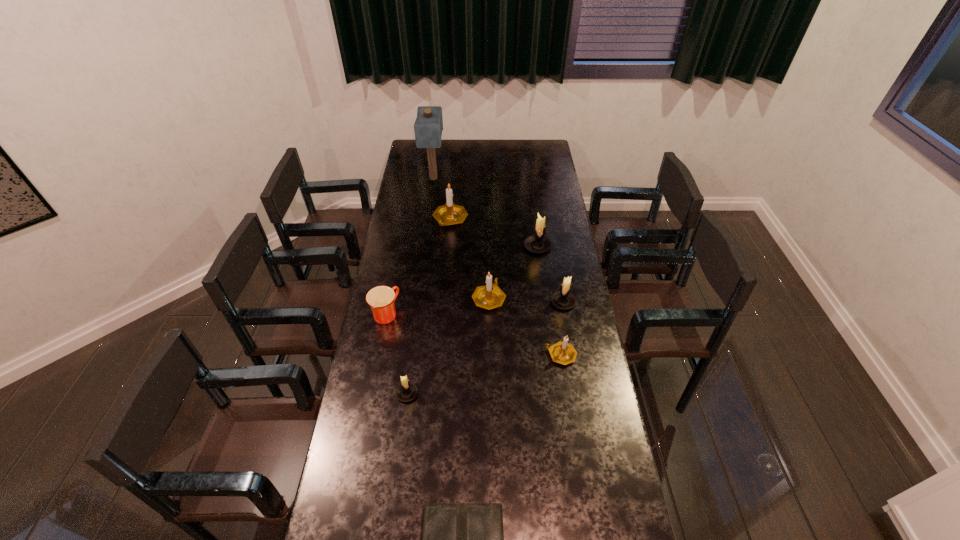
Where is `vacant space located on the back of the smallest gold candle holder`? The height and width of the screenshot is (540, 960). vacant space located on the back of the smallest gold candle holder is located at coordinates (549, 280).

Image resolution: width=960 pixels, height=540 pixels. I want to click on vacant space positioned 0.340m on the right of the leftmost object, so click(482, 313).

Identify the location of mallet at the left edge. This screenshot has height=540, width=960. (428, 126).

Where is `candle holder that is at the left edge`? The height and width of the screenshot is (540, 960). candle holder that is at the left edge is located at coordinates (407, 391).

What are the coordinates of `cup located at the left edge` in the screenshot? It's located at (381, 299).

This screenshot has height=540, width=960. Find the location of `vacant space at the far edge`. vacant space at the far edge is located at coordinates (448, 146).

In order to click on vacant space at the left edge in this screenshot , I will do `click(379, 490)`.

Locate an element on the screen. vacant space at the right edge of the desktop is located at coordinates (540, 179).

You are a GUI agent. You are given a task and a screenshot of the screen. Output one action in this format:
    pyautogui.click(x=<x>, y=<y>)
    Task: Click on the free space at the far left corner
    This screenshot has height=540, width=960.
    Given the screenshot: What is the action you would take?
    pyautogui.click(x=421, y=152)

The width and height of the screenshot is (960, 540). In order to click on free space between the second farthest white candle holder and the mallet in this screenshot , I will do `click(498, 240)`.